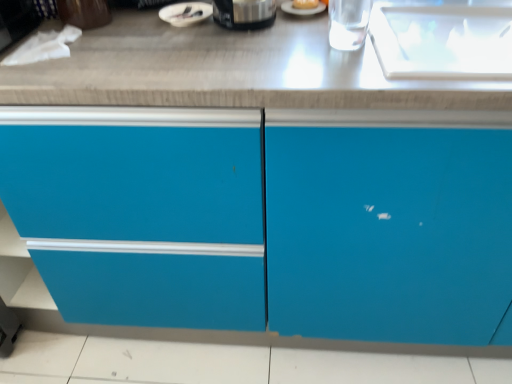
Find the location of a particular element. spots to the right of satin black coffee maker at upper center, the 2th appliance positioned from the left is located at coordinates (302, 28).